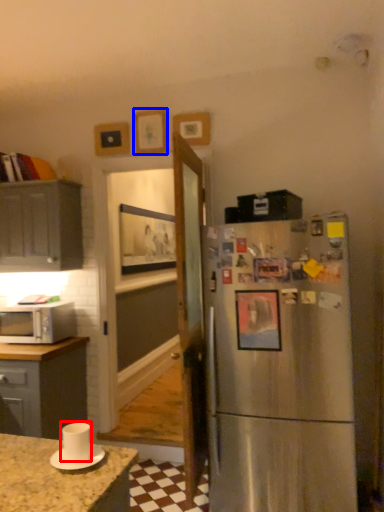
Question: Which object appears farthest to the camera in this image, appliance (highlighted by a red box) or picture frame (highlighted by a blue box)?

Choices:
 (A) appliance
 (B) picture frame

Answer: (B)